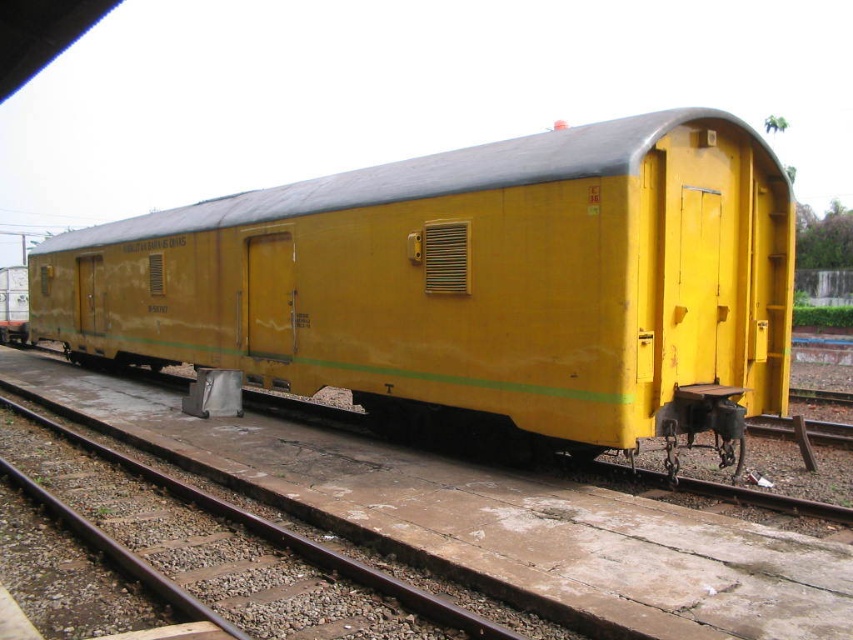
Can you confirm if yellow matte train car at center is thinner than brown metal train track at lower left?

No, yellow matte train car at center is not thinner than brown metal train track at lower left.

Who is higher up, yellow matte train car at center or brown metal train track at lower left?

yellow matte train car at center is above.

The height and width of the screenshot is (640, 853). I want to click on yellow matte train car at center, so click(x=473, y=284).

The height and width of the screenshot is (640, 853). In order to click on yellow matte train car at center in this screenshot , I will do `click(473, 284)`.